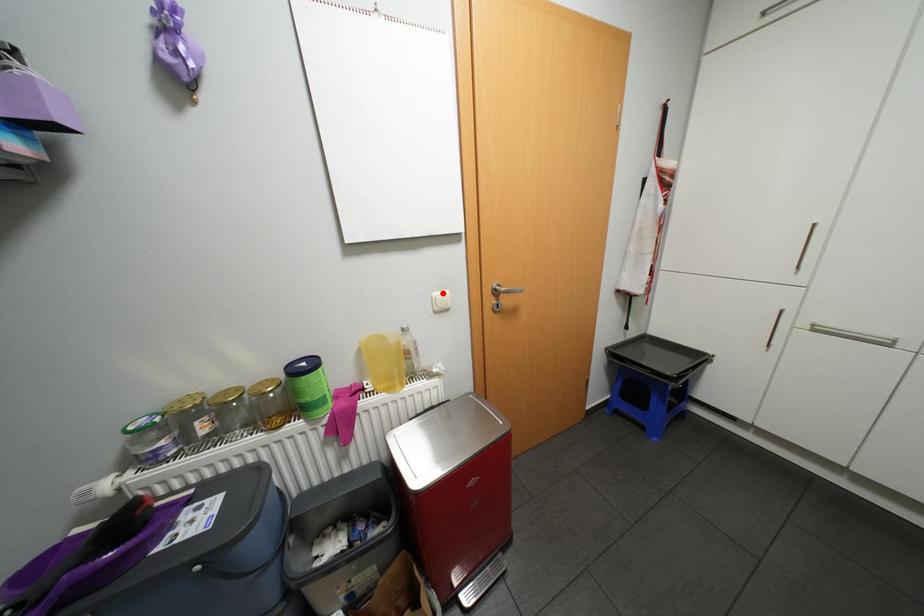
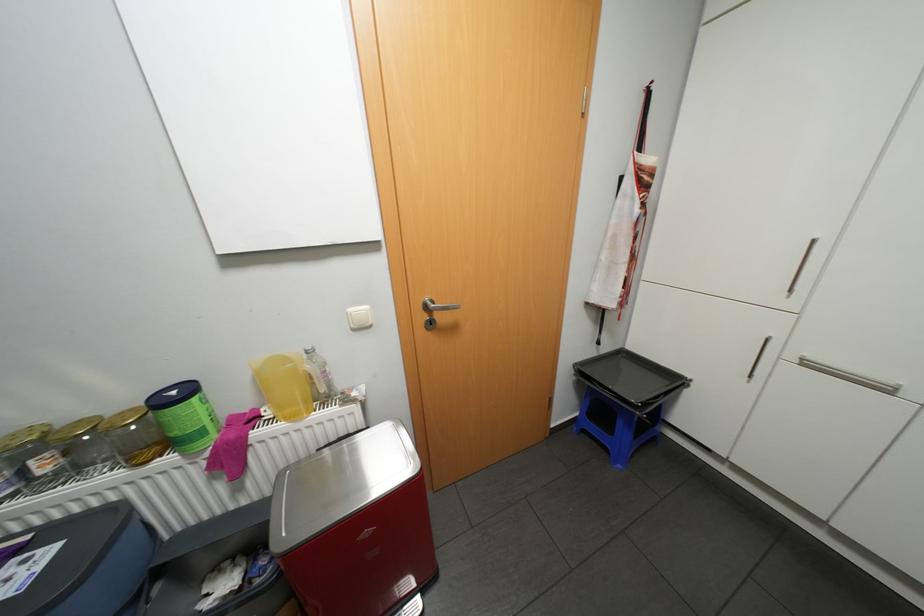
In the second image, find the point that corresponds to the highlighted location in the first image.

(358, 309)